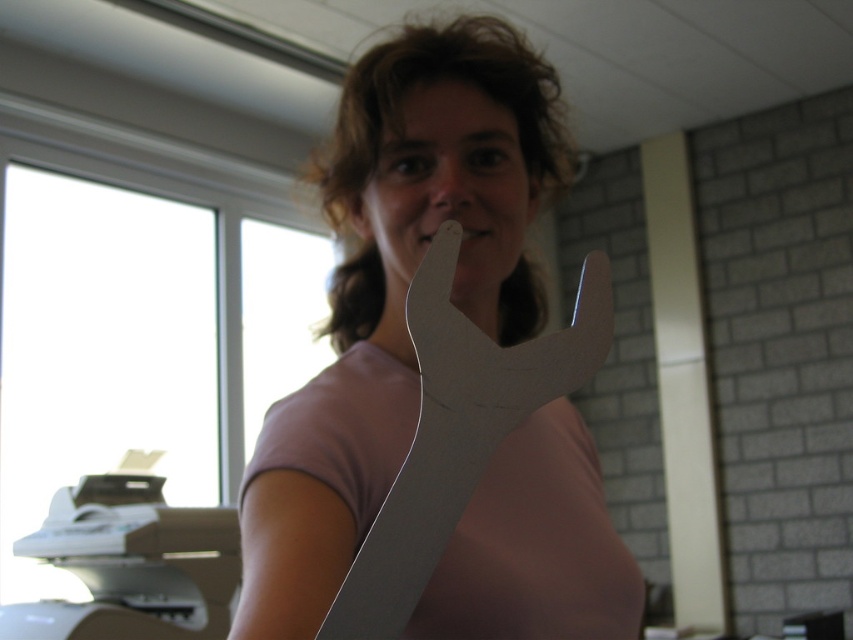
Is point (271, 618) farther from camera compared to point (474, 365)?

Yes, point (271, 618) is behind point (474, 365).

Is matte white wrench at center above metallic silver wrench at center?

Correct, matte white wrench at center is located above metallic silver wrench at center.

Find the location of a particular element. The width and height of the screenshot is (853, 640). matte white wrench at center is located at coordinates (397, 291).

Locate an element on the screen. The width and height of the screenshot is (853, 640). matte white wrench at center is located at coordinates (397, 291).

Who is positioned more to the right, matte white wrench at center or pink matte tongue at center?

pink matte tongue at center is more to the right.

Between point (396, 346) and point (485, 230), which one is positioned in front?

Point (485, 230) is in front.

Identify the location of matte white wrench at center. (397, 291).

Which is in front, point (447, 291) or point (608, 291)?

Point (447, 291) is in front.

Locate an element on the screen. The image size is (853, 640). white cardboard knife at center is located at coordinates (457, 433).